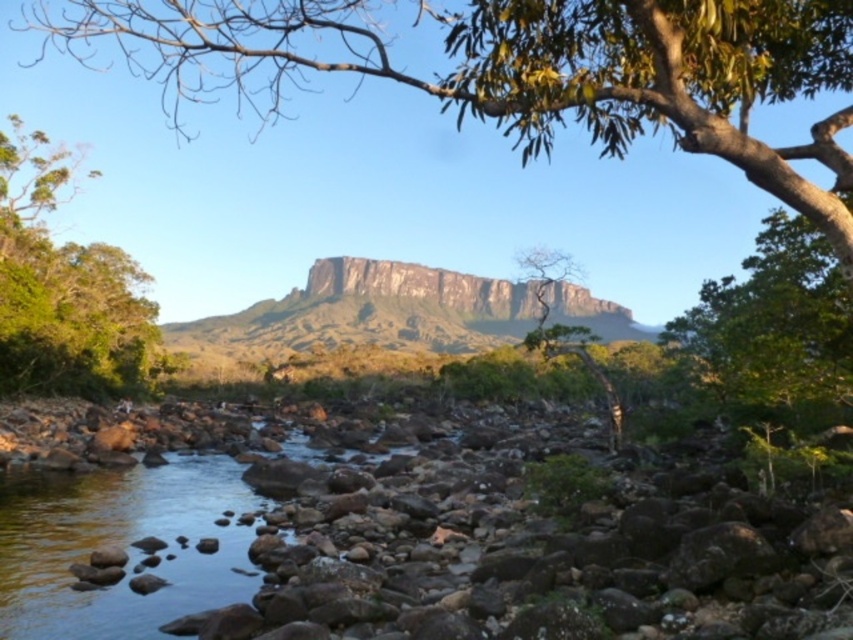
Is green leafy tree at left bigger than green leafy tree at center?

Actually, green leafy tree at left might be smaller than green leafy tree at center.

Between point (56, 314) and point (547, 298), which one is positioned behind?

Point (547, 298)

Find the location of a particular element. The height and width of the screenshot is (640, 853). green leafy tree at left is located at coordinates (67, 289).

Image resolution: width=853 pixels, height=640 pixels. What do you see at coordinates (67, 289) in the screenshot?
I see `green leafy tree at left` at bounding box center [67, 289].

Is green leafy tree at left to the right of brown rocky mountain at center from the viewer's perspective?

Incorrect, green leafy tree at left is not on the right side of brown rocky mountain at center.

Describe the element at coordinates (67, 289) in the screenshot. The width and height of the screenshot is (853, 640). I see `green leafy tree at left` at that location.

Identify the location of green leafy tree at left. (67, 289).

Is point (607, 324) closer to camera compared to point (575, 333)?

That is False.

Consider the image. Who is lower down, brown rocky mountain at center or green leafy tree at center?

green leafy tree at center

Image resolution: width=853 pixels, height=640 pixels. In order to click on brown rocky mountain at center in this screenshot , I will do (360, 316).